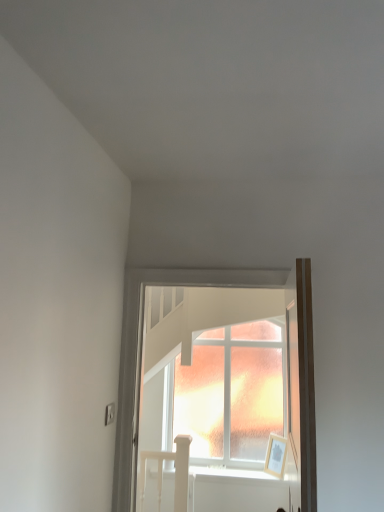
This screenshot has width=384, height=512. Identify the location of vacant point above frosted glass window at center (from a real-world perspective). (218, 263).